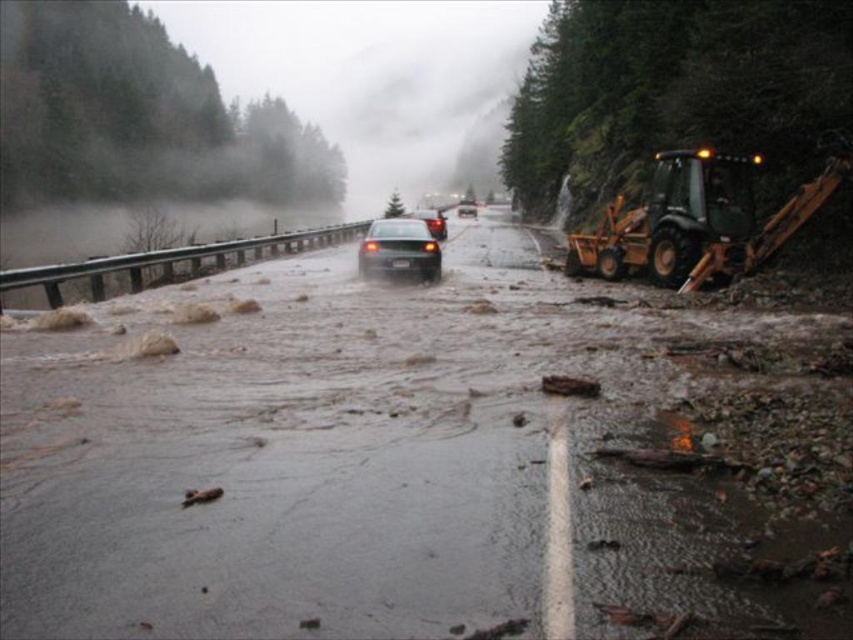
Question: Is black glossy sedan at center bigger than black rubber car at center?

Choices:
 (A) yes
 (B) no

Answer: (B)

Question: Which of the following is the closest to the observer?

Choices:
 (A) (437, 216)
 (B) (651, 264)

Answer: (B)

Question: Considering the real-world distances, which object is farthest from the green rubber excavator at right?

Choices:
 (A) black rubber car at center
 (B) brown muddy water at center

Answer: (A)

Question: Estimate the real-world distances between objects in this image. Which object is farther from the glossy black sedan at center?

Choices:
 (A) brown muddy water at center
 (B) black rubber car at center

Answer: (A)

Question: Is brown muddy water at center positioned at the back of green rubber excavator at right?

Choices:
 (A) yes
 (B) no

Answer: (B)

Question: Is green rubber excavator at right positioned in front of black rubber car at center?

Choices:
 (A) no
 (B) yes

Answer: (B)